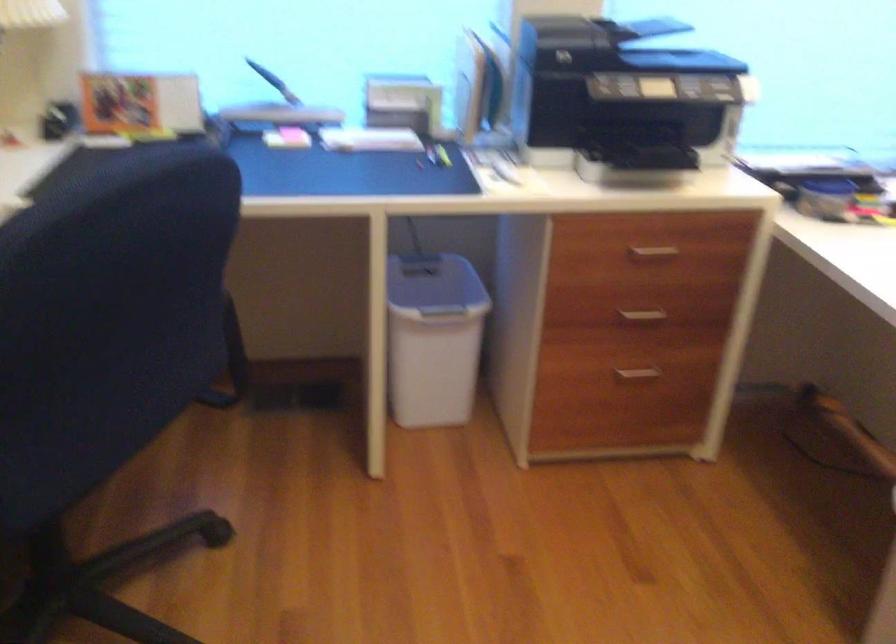
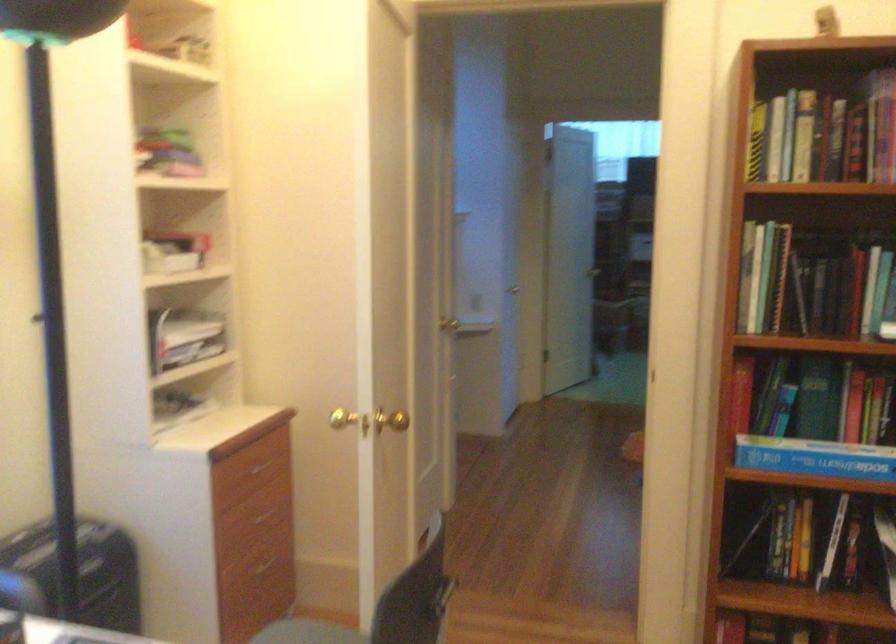
Question: The images are taken continuously from a first-person perspective. In which direction is your viewpoint rotating?

Choices:
 (A) Left
 (B) Right
 (C) Up
 (D) Down

Answer: (B)